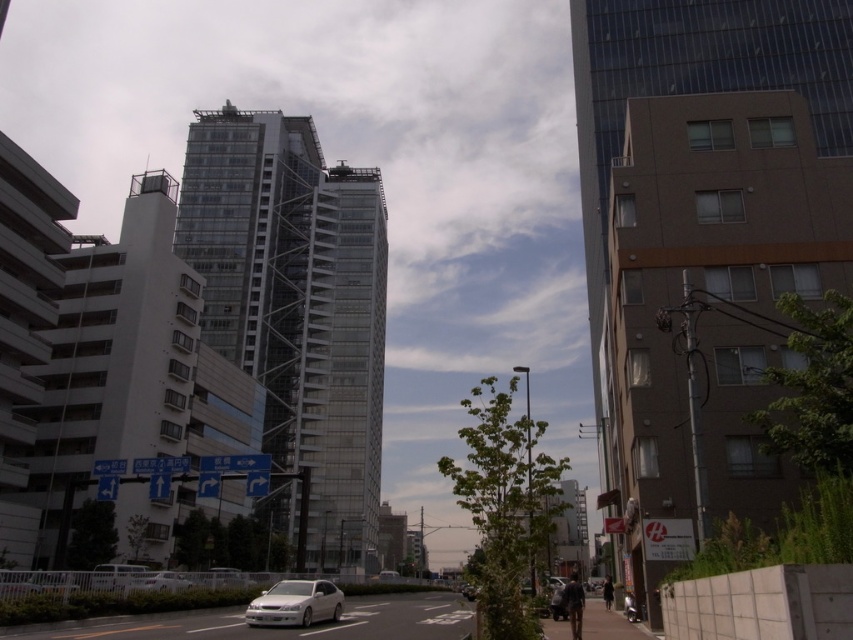
You are a city planner analyzing traffic patterns. You observe the glassy reflective tower at center and the white glossy sedan at center in the image. Which object takes up more space in the scene?

The glassy reflective tower at center has a larger size compared to the white glossy sedan at center, so it takes up more space in the scene.

You are a pedestrian standing on the sidewalk and want to cross the road to reach the transparent glass building at center. The white glossy sedan at center is in your path. Based on their positions, which direction should you move to avoid the sedan and reach your destination?

The transparent glass building at center is positioned on the left side of the white glossy sedan at center. To avoid the sedan and reach the building, you should move to the left side of the sedan since the building is located there.

You are standing at the point marked by point (700, 196) in the image. Looking around, you see the glassy reflective tower at center. Which direction should you face to see the glassy reflective tower at center?

You should face towards the center of the image because the glassy reflective tower at center is located at the center, so facing that direction from point (700, 196) will allow you to see it.